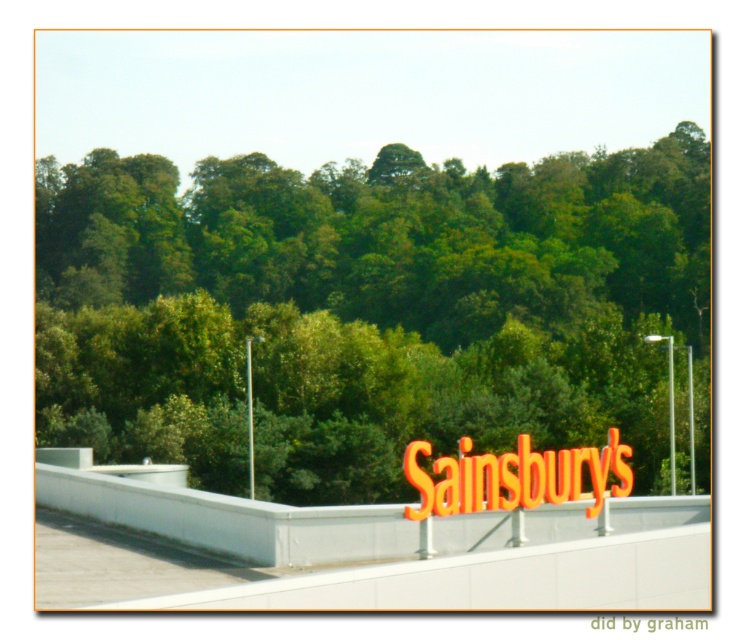
Based on the photo, which is above, white matte overpass at center or orange plastic sign at center?

Positioned higher is orange plastic sign at center.

Between point (213, 579) and point (589, 454), which one is positioned in front?

Point (213, 579)

Is point (128, 573) positioned before point (457, 467)?

Yes, it is in front of point (457, 467).

I want to click on white matte overpass at center, so click(354, 548).

Measure the distance between orange plastic sign at center and orange metallic sainsbury's sign at center.

orange plastic sign at center and orange metallic sainsbury's sign at center are 19.35 feet apart.

Does orange plastic sign at center appear over orange metallic sainsbury's sign at center?

Correct, orange plastic sign at center is located above orange metallic sainsbury's sign at center.

Is point (612, 458) farther from viewer compared to point (592, 621)?

Yes, point (612, 458) is behind point (592, 621).

Locate an element on the screen. This screenshot has width=746, height=640. orange plastic sign at center is located at coordinates (515, 477).

You are a GUI agent. You are given a task and a screenshot of the screen. Output one action in this format:
    pyautogui.click(x=<x>, y=<y>)
    Task: Click on the green leafy tree at upper center
    The height and width of the screenshot is (640, 746).
    Given the screenshot: What is the action you would take?
    pyautogui.click(x=372, y=310)

Between point (357, 481) and point (639, 557), which one is positioned in front?

Positioned in front is point (639, 557).

Between point (210, 275) and point (363, 605), which one is positioned behind?

Positioned behind is point (210, 275).

Locate an element on the screen. green leafy tree at upper center is located at coordinates (372, 310).